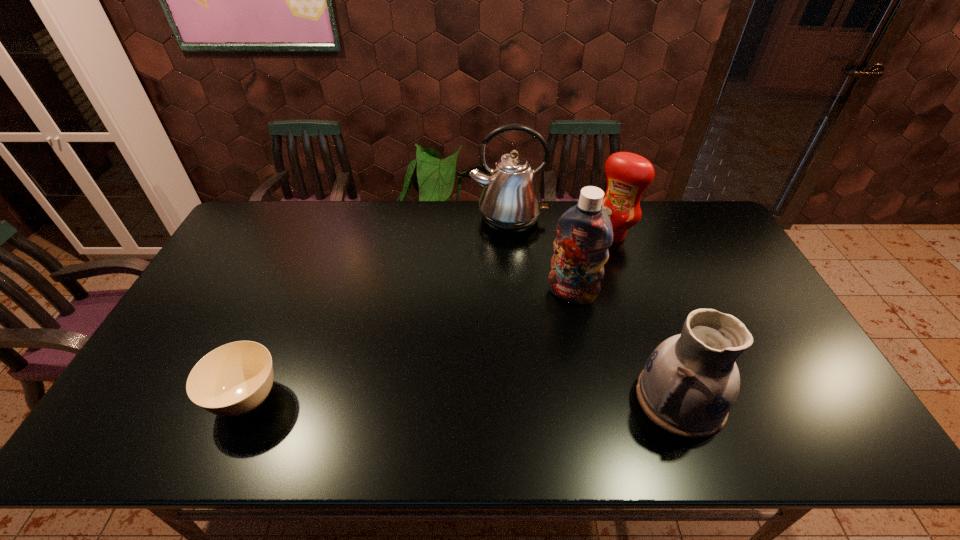
Find the location of a particular element. pottery present at the near edge is located at coordinates (690, 382).

In order to click on blank space at the far edge of the desktop in this screenshot , I will do `click(426, 239)`.

Locate an element on the screen. The height and width of the screenshot is (540, 960). vacant space at the near edge of the desktop is located at coordinates (337, 379).

In the image, there is a desktop. Identify the location of vacant space at the right edge. This screenshot has width=960, height=540. (771, 304).

The height and width of the screenshot is (540, 960). I want to click on free region at the far right corner, so click(x=687, y=220).

I want to click on vacant space that's between the pottery and the sugar bowl, so click(464, 399).

Image resolution: width=960 pixels, height=540 pixels. I want to click on empty space between the pottery and the third farthest object, so click(x=626, y=346).

I want to click on vacant region between the shampoo and the sugar bowl, so click(x=410, y=346).

You are a GUI agent. You are given a task and a screenshot of the screen. Output one action in this format:
    pyautogui.click(x=<x>, y=<y>)
    Task: Click on the unoccupied area between the shortest object and the pottery
    The height and width of the screenshot is (540, 960).
    Given the screenshot: What is the action you would take?
    coord(464,399)

Where is `empty space that is in between the kettle and the shampoo`? Image resolution: width=960 pixels, height=540 pixels. empty space that is in between the kettle and the shampoo is located at coordinates (540, 256).